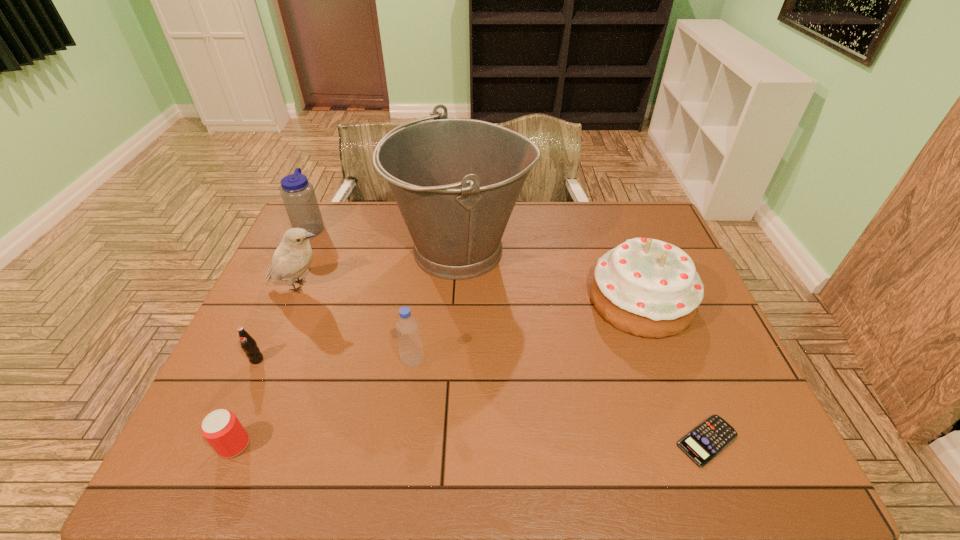
In the image, there is a desktop. Where is `vacant region at the left edge`? This screenshot has width=960, height=540. vacant region at the left edge is located at coordinates (274, 309).

Identify the location of vacant space at the right edge of the desktop. (746, 433).

In the image, there is a desktop. At what (x,y) coordinates should I click in order to perform the action: click on blank space at the far left corner. Please return your answer as a coordinate pair (x, y). Looking at the image, I should click on (341, 215).

Where is `free point at the far right corner`? This screenshot has height=540, width=960. free point at the far right corner is located at coordinates (613, 208).

The width and height of the screenshot is (960, 540). What are the coordinates of `empty location between the calculator and the cake` in the screenshot? It's located at (674, 370).

Locate an element on the screen. Image resolution: width=960 pixels, height=540 pixels. free area in between the bottle and the shortest object is located at coordinates (560, 401).

Locate an element on the screen. Image resolution: width=960 pixels, height=540 pixels. vacant space that is in between the cake and the calculator is located at coordinates (674, 370).

Locate an element on the screen. This screenshot has height=540, width=960. vacant area that lies between the bucket and the second shortest object is located at coordinates pyautogui.click(x=348, y=348).

Image resolution: width=960 pixels, height=540 pixels. Find the location of `vacant space that is in between the tallest object and the sixth tallest object`. vacant space that is in between the tallest object and the sixth tallest object is located at coordinates (359, 305).

Where is `vacant area that lies between the beer can and the sixth tallest object`? vacant area that lies between the beer can and the sixth tallest object is located at coordinates (246, 402).